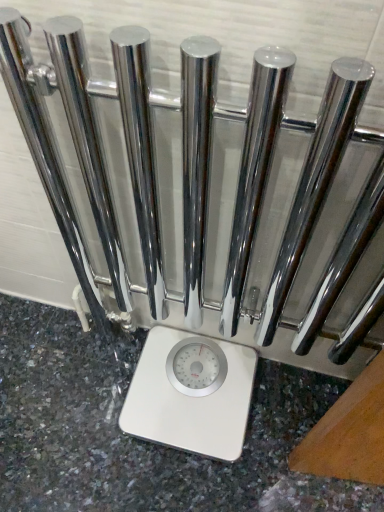
You are a GUI agent. You are given a task and a screenshot of the screen. Output one action in this format:
    pyautogui.click(x=<x>, y=<y>)
    Task: Click on the empty space that is to the right of white glossy scale at center
    The width and height of the screenshot is (384, 512).
    Given the screenshot: What is the action you would take?
    pyautogui.click(x=283, y=422)